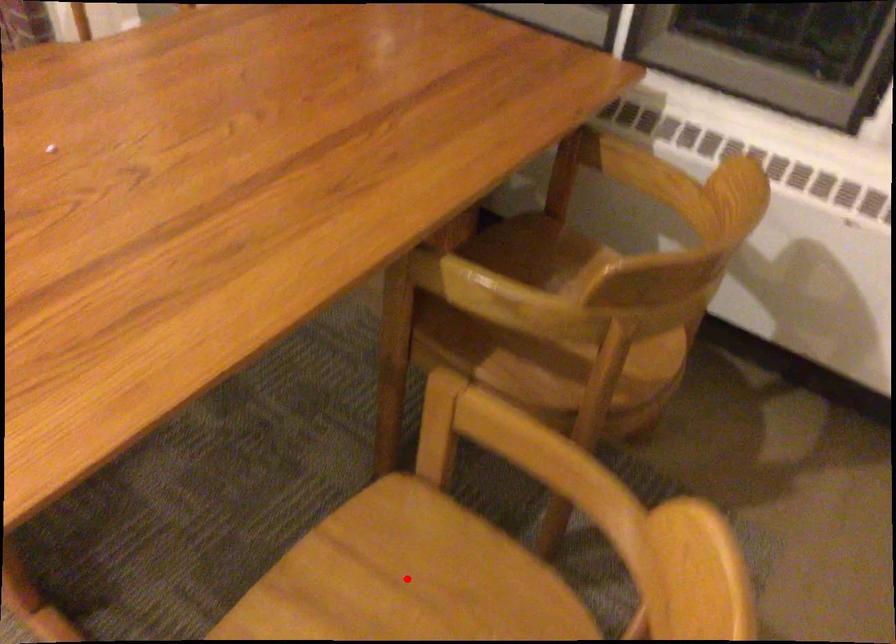
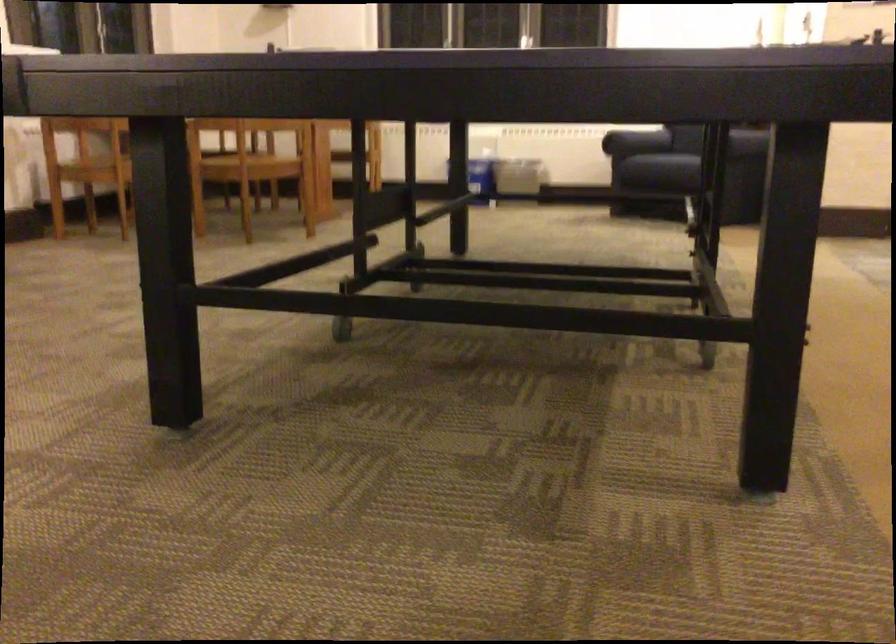
Question: I am providing you with two images of the same scene from different viewpoints. A red point is marked on the first image. Can you still see the location of the red point in image 2?

Choices:
 (A) Yes
 (B) No

Answer: (B)